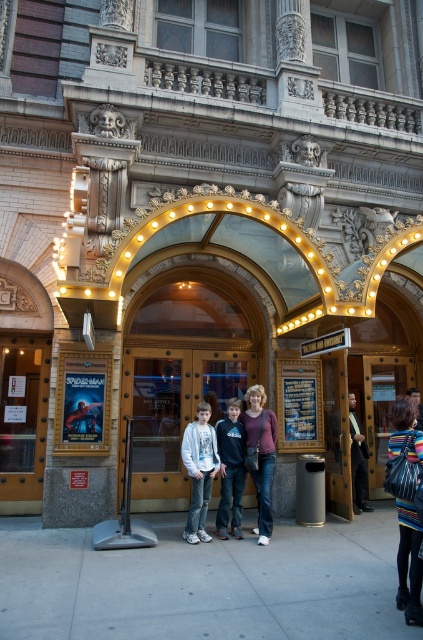
Looking at this image, you are standing at the entrance of the theater and notice two points marked on the wall. The first point is at coordinates point [257,438] and the second is at point [189,461]. Which point is closer to you?

Point [257,438] is further to the viewer than point [189,461], so the closer point to you is point [189,461].

You are standing at the entrance of the theater and want to locate the exact point where the ticket booth is situated. According to the image, where is the point labeled as point (173, 412) located?

The point labeled as point (173, 412) is located on the wooden door at center.